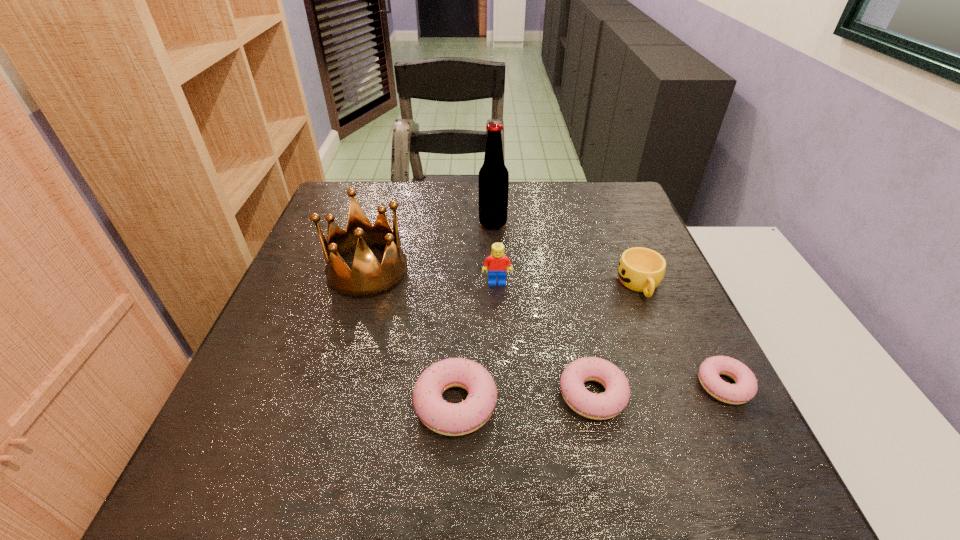
Where is `vacant area that lies between the leftmost doughnut and the cup`? The height and width of the screenshot is (540, 960). vacant area that lies between the leftmost doughnut and the cup is located at coordinates (548, 344).

You are a GUI agent. You are given a task and a screenshot of the screen. Output one action in this format:
    pyautogui.click(x=<x>, y=<y>)
    Task: Click on the vacant area between the leftmost object and the second doughnut from right to left
    This screenshot has height=540, width=960.
    Given the screenshot: What is the action you would take?
    pyautogui.click(x=480, y=333)

The height and width of the screenshot is (540, 960). I want to click on vacant space that is in between the tallest doughnut and the cup, so click(x=548, y=344).

Locate an element on the screen. This screenshot has width=960, height=540. vacant area between the second tallest object and the third object from right to left is located at coordinates (480, 333).

You are a GUI agent. You are given a task and a screenshot of the screen. Output one action in this format:
    pyautogui.click(x=<x>, y=<y>)
    Task: Click on the free space between the shortest object and the crown
    The width and height of the screenshot is (960, 540).
    Given the screenshot: What is the action you would take?
    pyautogui.click(x=546, y=328)

At what (x,y) coordinates should I click in order to perform the action: click on free space between the cup and the tallest object. Please return your answer as a coordinate pair (x, y). Looking at the image, I should click on (566, 254).

Where is `empty space that is in between the leftmost object and the tallest object`? This screenshot has height=540, width=960. empty space that is in between the leftmost object and the tallest object is located at coordinates (430, 247).

Identify the location of object that is the second closest to the shortest object. The image size is (960, 540). (640, 269).

The height and width of the screenshot is (540, 960). Identify the location of object that is the closest to the leftmost object. (497, 261).

You are a GUI agent. You are given a task and a screenshot of the screen. Output one action in this format:
    pyautogui.click(x=<x>, y=<y>)
    Task: Click on the doughnut that stands as the second closest to the cup
    The width and height of the screenshot is (960, 540).
    Given the screenshot: What is the action you would take?
    pyautogui.click(x=613, y=401)